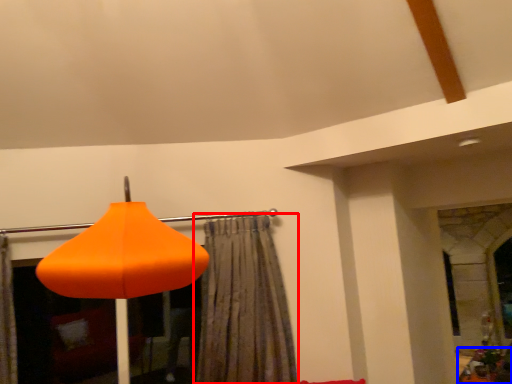
Question: Which object is closer to the camera taking this photo, curtain (highlighted by a red box) or furniture (highlighted by a blue box)?

Choices:
 (A) curtain
 (B) furniture

Answer: (A)